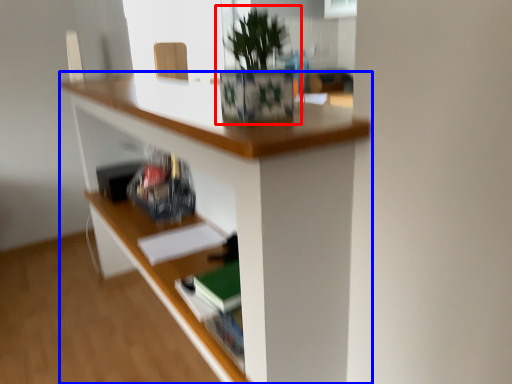
Question: Which point is further to the camera, houseplant (highlighted by a red box) or desk (highlighted by a blue box)?

Choices:
 (A) houseplant
 (B) desk

Answer: (A)